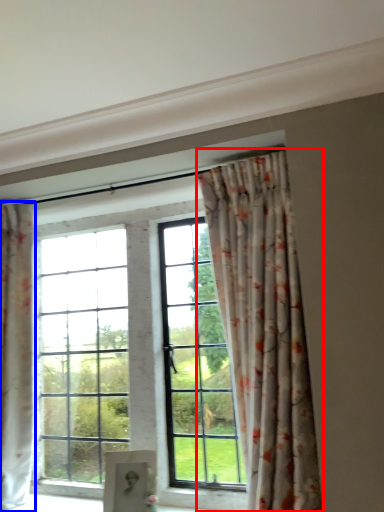
Question: Which of the following is the closest to the observer, curtain (highlighted by a red box) or curtain (highlighted by a blue box)?

Choices:
 (A) curtain
 (B) curtain

Answer: (A)